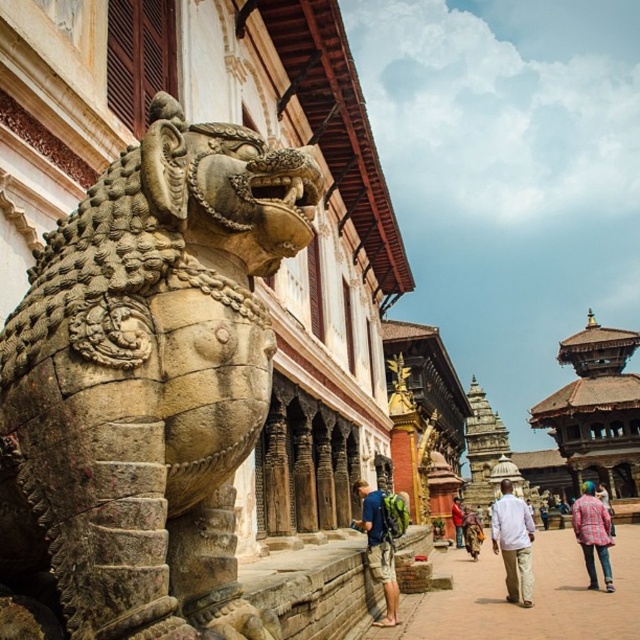
Does stone textured lion at left come behind white cotton shirt at center?

No, stone textured lion at left is in front of white cotton shirt at center.

Does stone textured lion at left appear under white cotton shirt at center?

Actually, stone textured lion at left is above white cotton shirt at center.

Does point (40, 404) lie in front of point (497, 497)?

Yes, point (40, 404) is closer to viewer.

You are a GUI agent. You are given a task and a screenshot of the screen. Output one action in this format:
    pyautogui.click(x=<x>, y=<y>)
    Task: Click on the stone textured lion at left
    
    Given the screenshot: What is the action you would take?
    pyautogui.click(x=145, y=387)

Between brown stone pagoda at center and red plaid shirt at center, which one is positioned higher?

red plaid shirt at center is above.

Which of these two, brown stone pagoda at center or red plaid shirt at center, stands taller?

brown stone pagoda at center

The height and width of the screenshot is (640, 640). Describe the element at coordinates (596, 410) in the screenshot. I see `brown stone pagoda at center` at that location.

You are a GUI agent. You are given a task and a screenshot of the screen. Output one action in this format:
    pyautogui.click(x=<x>, y=<y>)
    Task: Click on the brown stone pagoda at center
    The image size is (640, 640).
    Given the screenshot: What is the action you would take?
    pyautogui.click(x=596, y=410)

From the picture: Which is more to the right, white cotton shirt at center or plaid shirt at lower right?

Positioned to the right is plaid shirt at lower right.

Is white cotton shirt at center taller than plaid shirt at lower right?

Indeed, white cotton shirt at center has a greater height compared to plaid shirt at lower right.

This screenshot has width=640, height=640. What are the coordinates of `white cotton shirt at center` in the screenshot? It's located at point(513,541).

Locate an element on the screen. This screenshot has width=640, height=640. white cotton shirt at center is located at coordinates (513, 541).